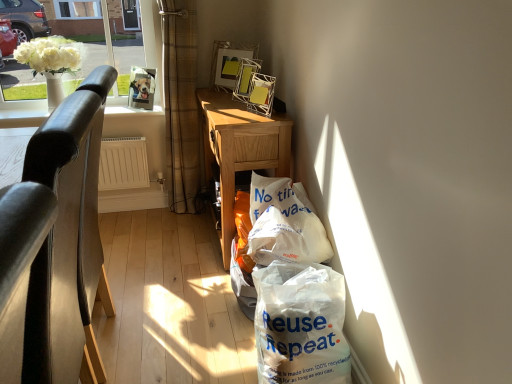
At what (x,y) coordinates should I click in order to perform the action: click on vacant space that is to the left of white plastic bag at lower right. Please return your answer as a coordinate pair (x, y). This screenshot has height=384, width=512. Looking at the image, I should click on (218, 358).